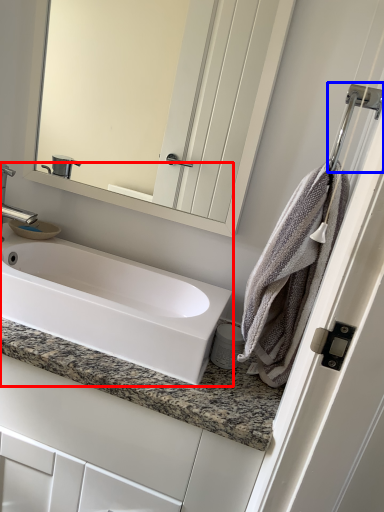
Question: Which of the following is the farthest to the observer, sink (highlighted by a red box) or shower (highlighted by a blue box)?

Choices:
 (A) sink
 (B) shower

Answer: (A)